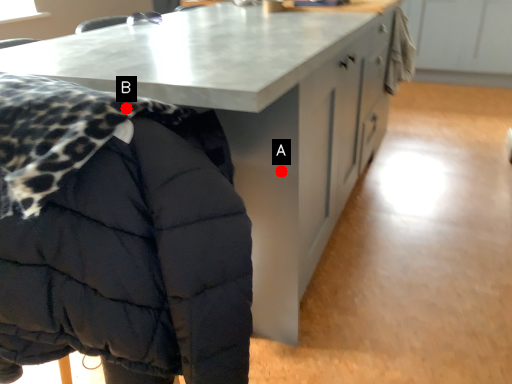
Question: Two points are circled on the image, labeled by A and B beside each circle. Which of the following is the farthest from the observer?

Choices:
 (A) A is further
 (B) B is further

Answer: (A)